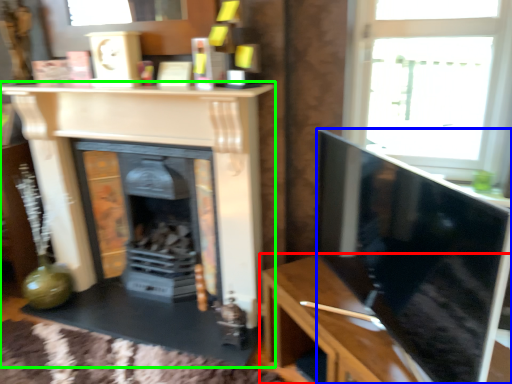
Question: Which object is the farthest from table (highlighted by a red box)? Choose among these: screen (highlighted by a blue box) or fireplace (highlighted by a green box).

Choices:
 (A) screen
 (B) fireplace

Answer: (B)